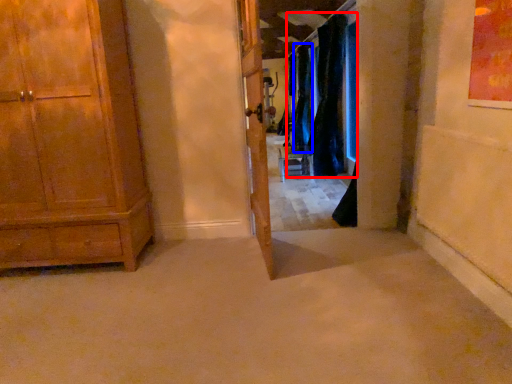
Question: Which of the following is the farthest to the observer, curtain (highlighted by a red box) or curtain (highlighted by a blue box)?

Choices:
 (A) curtain
 (B) curtain

Answer: (B)